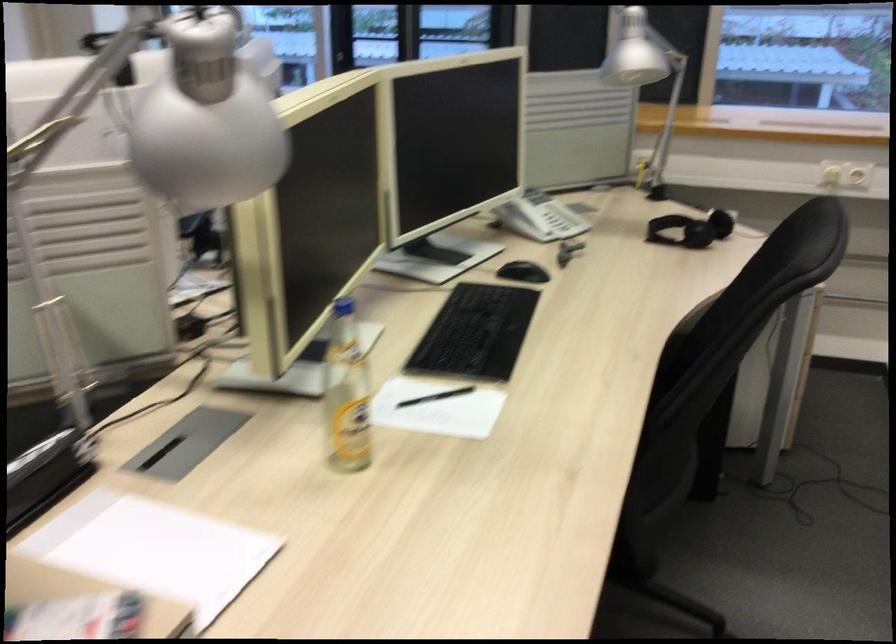
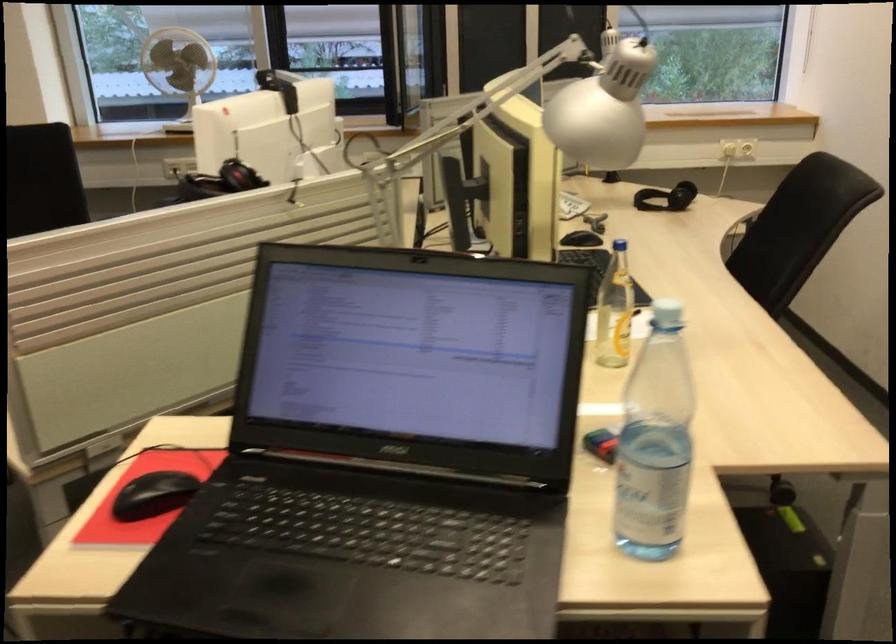
In the second image, find the point that corresponds to point 343,314 in the first image.

(618, 245)